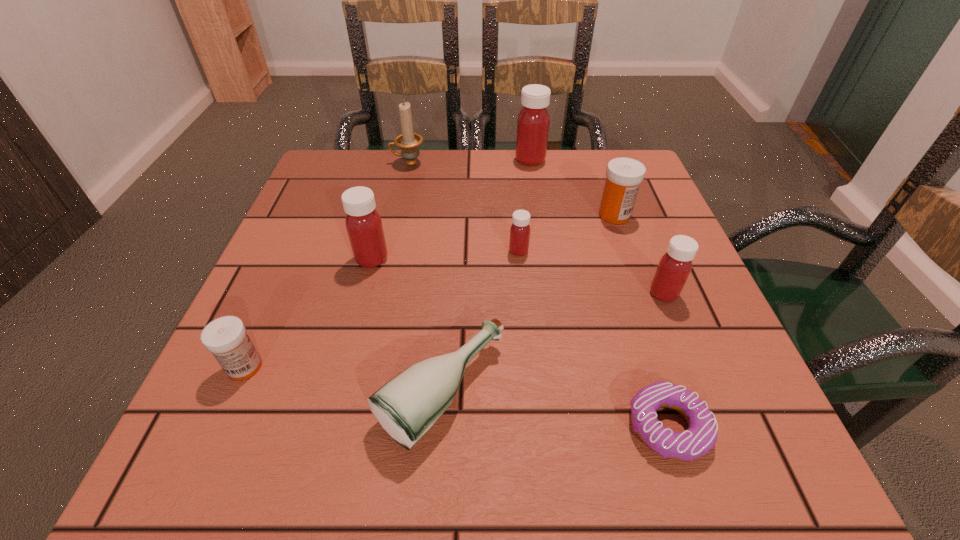
Identify the location of vacant space that satisfies the following two spatial constraints: 1. on the handle side of the candle_holder; 2. on the left side of the shortest object. Image resolution: width=960 pixels, height=540 pixels. (350, 426).